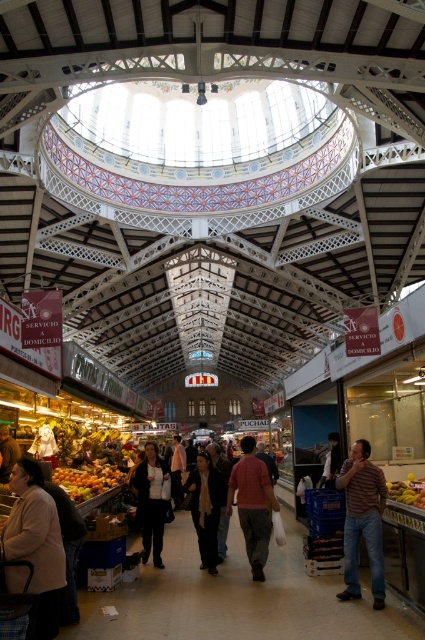
Which of these two, matte pink shirt at center or dark gray sweater at center, stands taller?

dark gray sweater at center is taller.

Is point (258, 513) less distant than point (178, 484)?

Yes, it is in front of point (178, 484).

You are a GUI agent. You are given a task and a screenshot of the screen. Output one action in this format:
    pyautogui.click(x=<x>, y=<y>)
    Task: Click on the matte pink shirt at center
    The width and height of the screenshot is (425, 640).
    Given the screenshot: What is the action you would take?
    pyautogui.click(x=252, y=504)

Find the location of a particular element. This screenshot has width=425, height=640. matte pink shirt at center is located at coordinates (252, 504).

Who is more forward, [379,572] or [161,467]?

Point [379,572] is in front.

You are a GUI agent. You are given a task and a screenshot of the screen. Output one action in this format:
    pyautogui.click(x=<x>, y=<y>)
    Task: Click on the striped shirt at lower right
    The width and height of the screenshot is (425, 640).
    Given the screenshot: What is the action you would take?
    pyautogui.click(x=362, y=520)

Can you confirm if beige wool coat at lower left is smaller than yellow matte bananas at lower right?

Incorrect, beige wool coat at lower left is not smaller in size than yellow matte bananas at lower right.

Is point (53, 579) closer to camera compared to point (401, 496)?

Yes, it is.

I want to click on beige wool coat at lower left, so click(x=36, y=545).